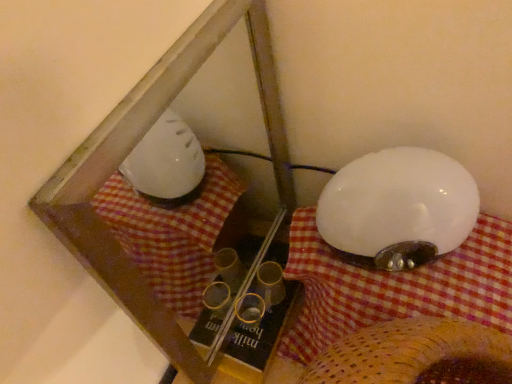
Question: Is white fabric at upper right shorter than white glossy lampshade at right?

Choices:
 (A) no
 (B) yes

Answer: (A)

Question: Is white fabric at upper right not within white glossy lampshade at right?

Choices:
 (A) yes
 (B) no

Answer: (A)

Question: Is white fabric at upper right oriented towards white glossy lampshade at right?

Choices:
 (A) yes
 (B) no

Answer: (B)

Question: Is white fabric at upper right positioned in front of white glossy lampshade at right?

Choices:
 (A) yes
 (B) no

Answer: (A)

Question: Is white fabric at upper right with white glossy lampshade at right?

Choices:
 (A) no
 (B) yes

Answer: (B)

Question: From the image's perspective, is white fabric at upper right on top of white glossy lampshade at right?

Choices:
 (A) yes
 (B) no

Answer: (B)

Question: Is transparent plastic glass box at center smaller than white glossy lampshade at right?

Choices:
 (A) yes
 (B) no

Answer: (B)

Question: Does transparent plastic glass box at center have a greater height compared to white glossy lampshade at right?

Choices:
 (A) yes
 (B) no

Answer: (A)

Question: Can you confirm if transparent plastic glass box at center is bigger than white glossy lampshade at right?

Choices:
 (A) no
 (B) yes

Answer: (B)

Question: Is the depth of transparent plastic glass box at center greater than that of white glossy lampshade at right?

Choices:
 (A) yes
 (B) no

Answer: (B)

Question: Can you confirm if transparent plastic glass box at center is positioned to the right of white glossy lampshade at right?

Choices:
 (A) no
 (B) yes

Answer: (A)

Question: Is transparent plastic glass box at center positioned with its back to white glossy lampshade at right?

Choices:
 (A) no
 (B) yes

Answer: (B)

Question: Does white glossy lampshade at right come behind white fabric at upper right?

Choices:
 (A) yes
 (B) no

Answer: (A)